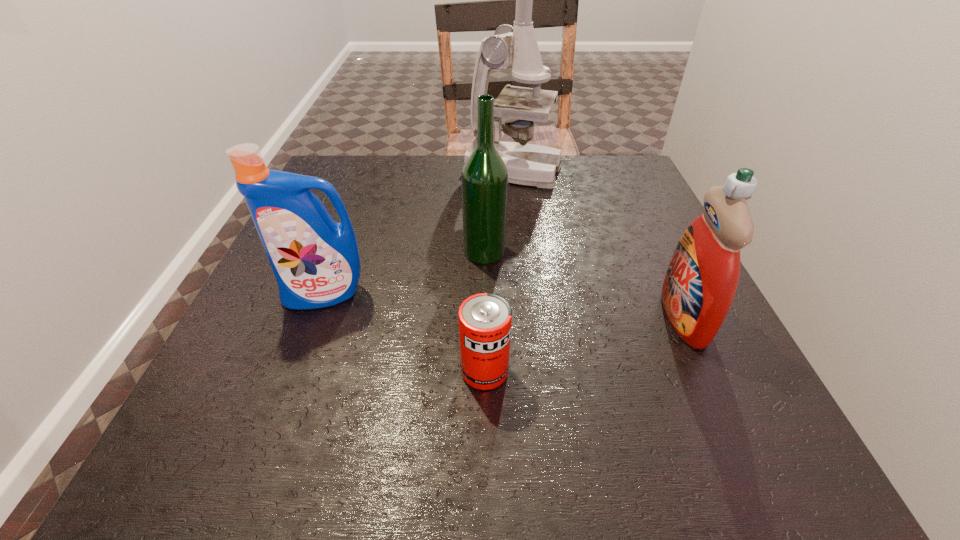
The width and height of the screenshot is (960, 540). I want to click on microscope, so click(x=515, y=47).

Image resolution: width=960 pixels, height=540 pixels. In order to click on the farthest object in this screenshot , I will do `click(515, 47)`.

The width and height of the screenshot is (960, 540). In order to click on the second farthest object in this screenshot , I will do `click(484, 178)`.

At what (x,y) coordinates should I click in order to perform the action: click on the left detergent. Please return your answer as a coordinate pair (x, y). Looking at the image, I should click on (316, 262).

What are the coordinates of `the right detergent` in the screenshot? It's located at tap(699, 287).

Find the location of a particular element. The height and width of the screenshot is (540, 960). the shortest object is located at coordinates (485, 319).

Locate an element on the screen. The width and height of the screenshot is (960, 540). vacant space located 0.260m on the left of the tallest object is located at coordinates (363, 171).

This screenshot has width=960, height=540. In order to click on vacant space located 0.150m on the front of the fourth nearest object in this screenshot , I will do `click(485, 322)`.

Locate an element on the screen. free space located on the label of the left detergent is located at coordinates (265, 455).

Identify the location of vacant region located 0.060m on the front surface of the rightmost object. The width and height of the screenshot is (960, 540). (628, 316).